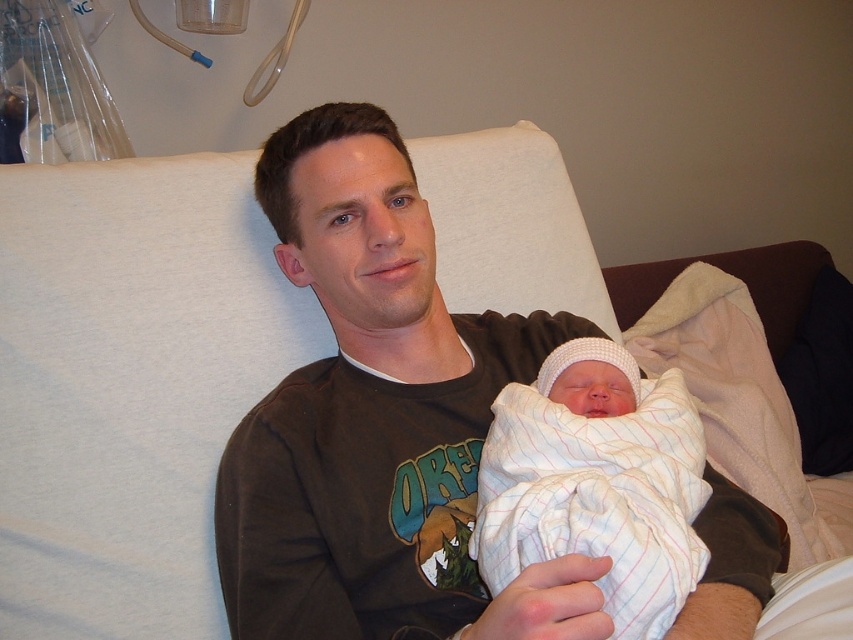
Question: Does brown cotton shirt at center come in front of white striped swaddle at center?

Choices:
 (A) no
 (B) yes

Answer: (B)

Question: Observing the image, what is the correct spatial positioning of brown cotton shirt at center in reference to white striped swaddle at center?

Choices:
 (A) above
 (B) below

Answer: (A)

Question: Observing the image, what is the correct spatial positioning of brown cotton shirt at center in reference to white striped swaddle at center?

Choices:
 (A) below
 (B) above

Answer: (B)

Question: Which point is farther to the camera?

Choices:
 (A) pyautogui.click(x=553, y=474)
 (B) pyautogui.click(x=315, y=424)

Answer: (B)

Question: Among these objects, which one is farthest from the camera?

Choices:
 (A) brown cotton shirt at center
 (B) white striped swaddle at center

Answer: (B)